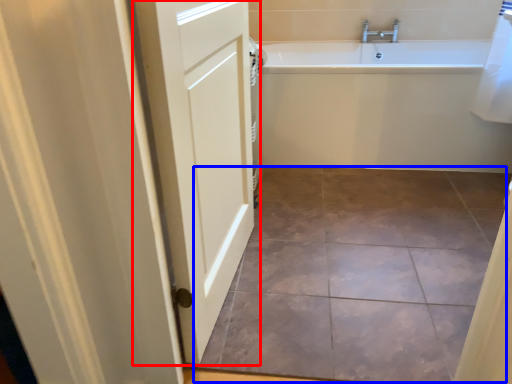
Question: Which object is closer to the camera taking this photo, door (highlighted by a red box) or ceramic tile (highlighted by a blue box)?

Choices:
 (A) door
 (B) ceramic tile

Answer: (A)